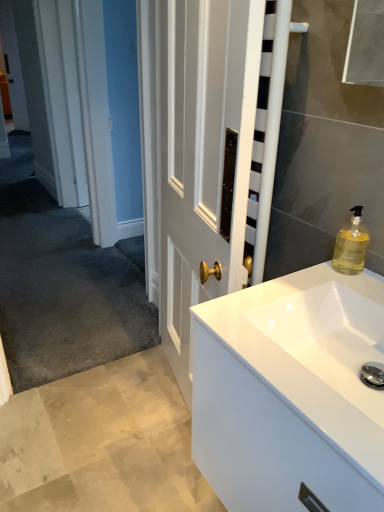
The width and height of the screenshot is (384, 512). What do you see at coordinates (291, 392) in the screenshot?
I see `white glossy cabinet at lower right` at bounding box center [291, 392].

The height and width of the screenshot is (512, 384). I want to click on white glossy cabinet at lower right, so click(291, 392).

This screenshot has width=384, height=512. Describe the element at coordinates (351, 246) in the screenshot. I see `translucent yellow liquid at upper right` at that location.

Find the location of `translucent yellow liquid at upper right`. translucent yellow liquid at upper right is located at coordinates click(351, 246).

I want to click on white glossy cabinet at lower right, so click(291, 392).

Based on their positions, is white glossy cabinet at lower right located to the left or right of translucent yellow liquid at upper right?

In the image, white glossy cabinet at lower right appears on the left side of translucent yellow liquid at upper right.

Relative to translucent yellow liquid at upper right, is white glossy cabinet at lower right in front or behind?

In the image, white glossy cabinet at lower right appears in front of translucent yellow liquid at upper right.

Which is closer to the camera, (363, 309) or (356, 257)?

Point (363, 309).

From the image's perspective, relative to translucent yellow liquid at upper right, is white glossy cabinet at lower right above or below?

From the image's perspective, white glossy cabinet at lower right appears below translucent yellow liquid at upper right.

From a real-world perspective, is white glossy cabinet at lower right positioned over translucent yellow liquid at upper right based on gravity?

No.

Which object is thinner, white glossy cabinet at lower right or translucent yellow liquid at upper right?

Thinner between the two is translucent yellow liquid at upper right.

Who is shorter, white glossy cabinet at lower right or translucent yellow liquid at upper right?

Standing shorter between the two is white glossy cabinet at lower right.

Between white glossy cabinet at lower right and translucent yellow liquid at upper right, which one has smaller size?

translucent yellow liquid at upper right is smaller.

Is white glossy cabinet at lower right not inside translucent yellow liquid at upper right?

Indeed, white glossy cabinet at lower right is completely outside translucent yellow liquid at upper right.

Would you say white glossy cabinet at lower right is a long distance from translucent yellow liquid at upper right?

No, there isn't a large distance between white glossy cabinet at lower right and translucent yellow liquid at upper right.

Is white glossy cabinet at lower right facing away from translucent yellow liquid at upper right?

No, translucent yellow liquid at upper right is not at the back of white glossy cabinet at lower right.

How much distance is there between white glossy cabinet at lower right and translucent yellow liquid at upper right?

A distance of 15.74 inches exists between white glossy cabinet at lower right and translucent yellow liquid at upper right.

Identify the location of soap dispenser that appears above the white glossy cabinet at lower right (from the image's perspective). This screenshot has width=384, height=512. click(351, 246).

Considering the relative positions of translucent yellow liquid at upper right and white glossy cabinet at lower right in the image provided, is translucent yellow liquid at upper right to the left of white glossy cabinet at lower right from the viewer's perspective?

No, translucent yellow liquid at upper right is not to the left of white glossy cabinet at lower right.

Is the depth of translucent yellow liquid at upper right greater than that of white glossy cabinet at lower right?

That is True.

Does point (340, 266) come farther from viewer compared to point (238, 378)?

That is True.

From the image's perspective, is translucent yellow liquid at upper right located above white glossy cabinet at lower right?

Yes, from the image's perspective, translucent yellow liquid at upper right is over white glossy cabinet at lower right.

From a real-world perspective, does translucent yellow liquid at upper right sit lower than white glossy cabinet at lower right?

No, from a real-world perspective, translucent yellow liquid at upper right is not under white glossy cabinet at lower right.

Is translucent yellow liquid at upper right thinner than white glossy cabinet at lower right?

Yes, translucent yellow liquid at upper right is thinner than white glossy cabinet at lower right.

Does translucent yellow liquid at upper right have a lesser height compared to white glossy cabinet at lower right?

In fact, translucent yellow liquid at upper right may be taller than white glossy cabinet at lower right.

Can you confirm if translucent yellow liquid at upper right is smaller than white glossy cabinet at lower right?

Correct, translucent yellow liquid at upper right occupies less space than white glossy cabinet at lower right.

Is translucent yellow liquid at upper right spatially inside white glossy cabinet at lower right, or outside of it?

translucent yellow liquid at upper right exists outside the volume of white glossy cabinet at lower right.

Is translucent yellow liquid at upper right far from white glossy cabinet at lower right?

No, translucent yellow liquid at upper right is not far from white glossy cabinet at lower right.

Consider the image. Could you tell me if translucent yellow liquid at upper right is facing white glossy cabinet at lower right?

No.

Where is `bathroom cabinet located underneath the translucent yellow liquid at upper right (from a real-world perspective)`? bathroom cabinet located underneath the translucent yellow liquid at upper right (from a real-world perspective) is located at coordinates pyautogui.click(x=291, y=392).

Locate an element on the screen. bathroom cabinet below the translucent yellow liquid at upper right (from the image's perspective) is located at coordinates (291, 392).

Locate an element on the screen. The image size is (384, 512). bathroom cabinet that is under the translucent yellow liquid at upper right (from a real-world perspective) is located at coordinates (291, 392).